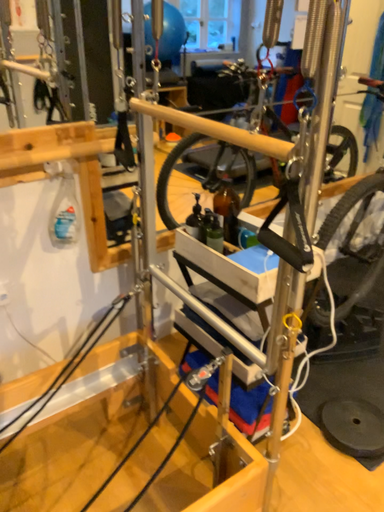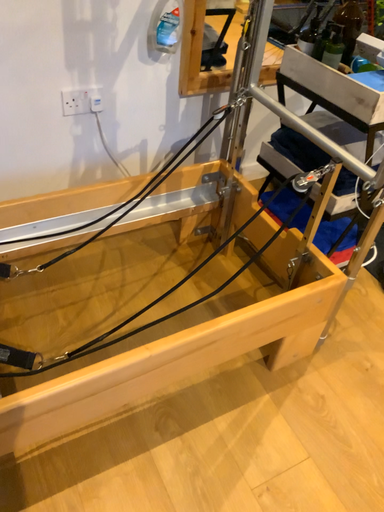
Question: How did the camera likely rotate when shooting the video?

Choices:
 (A) rotated downward
 (B) rotated upward

Answer: (A)